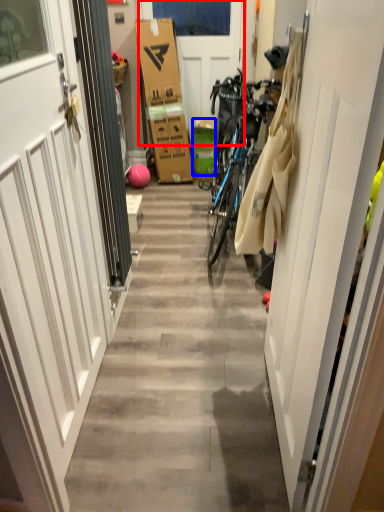
Question: Which of the following is the farthest to the observer, door (highlighted by a red box) or box (highlighted by a blue box)?

Choices:
 (A) door
 (B) box

Answer: (B)